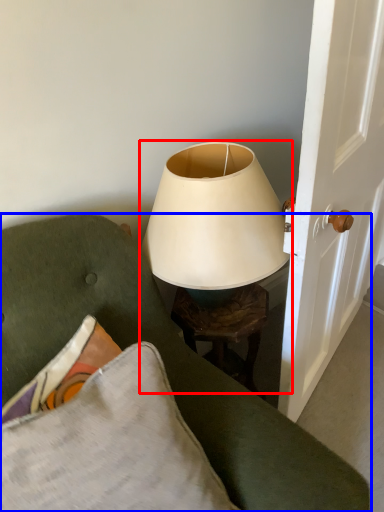
Question: Which of the following is the farthest to the observer, lamp (highlighted by a red box) or furniture (highlighted by a blue box)?

Choices:
 (A) lamp
 (B) furniture

Answer: (A)